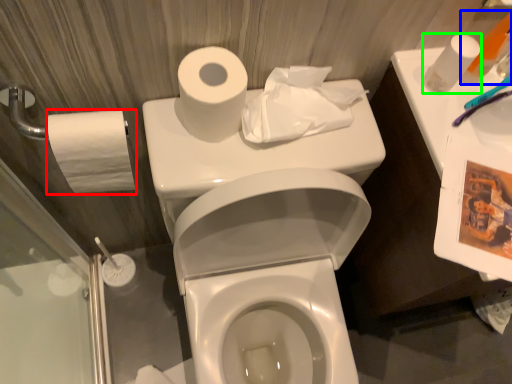
Question: Estimate the real-world distances between objects in this image. Which object is closer to toilet paper (highlighted by a red box), toiletry (highlighted by a blue box) or toilet paper (highlighted by a green box)?

Choices:
 (A) toiletry
 (B) toilet paper

Answer: (B)